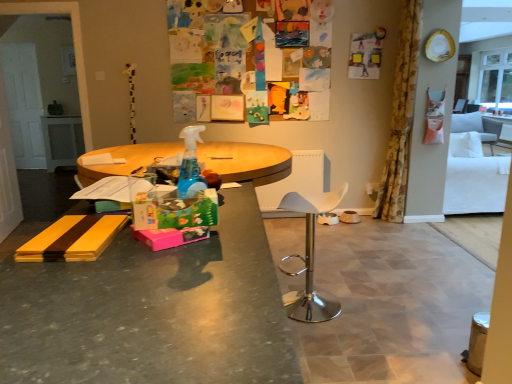
Question: From a real-world perspective, is floral fabric curtain at right positioned above or below brown ceramic bowl at center, the 1th bowl when ordered from right to left?

Choices:
 (A) above
 (B) below

Answer: (A)

Question: Is floral fabric curtain at right spatially inside brown ceramic bowl at center, the 1th bowl when ordered from right to left, or outside of it?

Choices:
 (A) outside
 (B) inside

Answer: (A)

Question: Which of these objects is positioned farthest from the white fabric armchair at right, the second armchair when ordered from top to bottom?

Choices:
 (A) white fabric couch at right
 (B) floral fabric curtain at right
 (C) clear glass window at upper right
 (D) white fabric armchair at right, which ranks as the second armchair in left-to-right order
 (E) matte gray desk at center

Answer: (E)

Question: Which is nearer to the matte gray desk at center?

Choices:
 (A) floral fabric curtain at right
 (B) silver metallic bowl at center, the first bowl from the left
 (C) white fabric couch at right
 (D) white fabric armchair at right, the first armchair in the top-to-bottom sequence
 (E) brown ceramic bowl at center, the 1th bowl when ordered from right to left

Answer: (A)